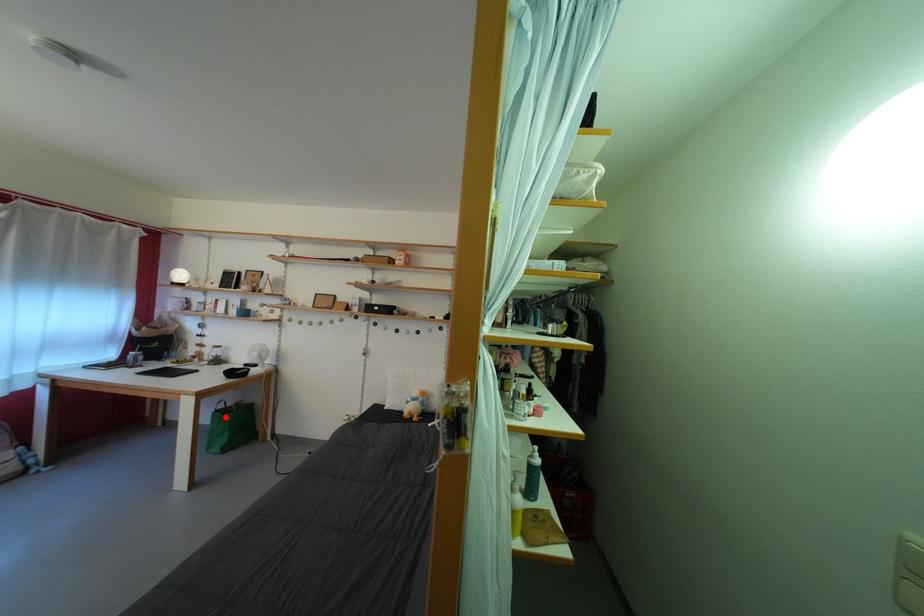
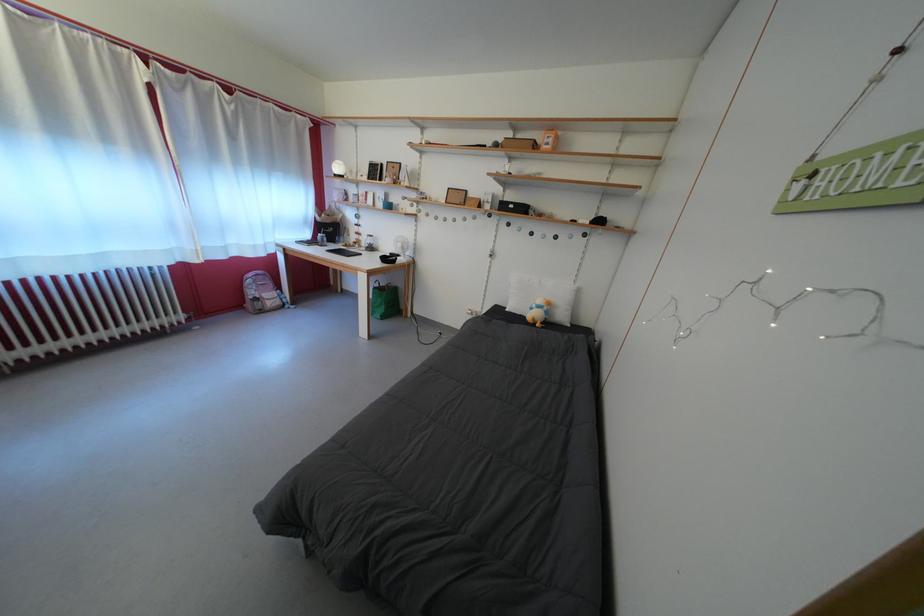
Question: I am providing you with two images of the same scene from different viewpoints. Image1 has a red point marked. In image2, the corresponding 3D location appears at what relative position? Reply with the corresponding letter.

Choices:
 (A) Closer
 (B) Farther

Answer: (A)